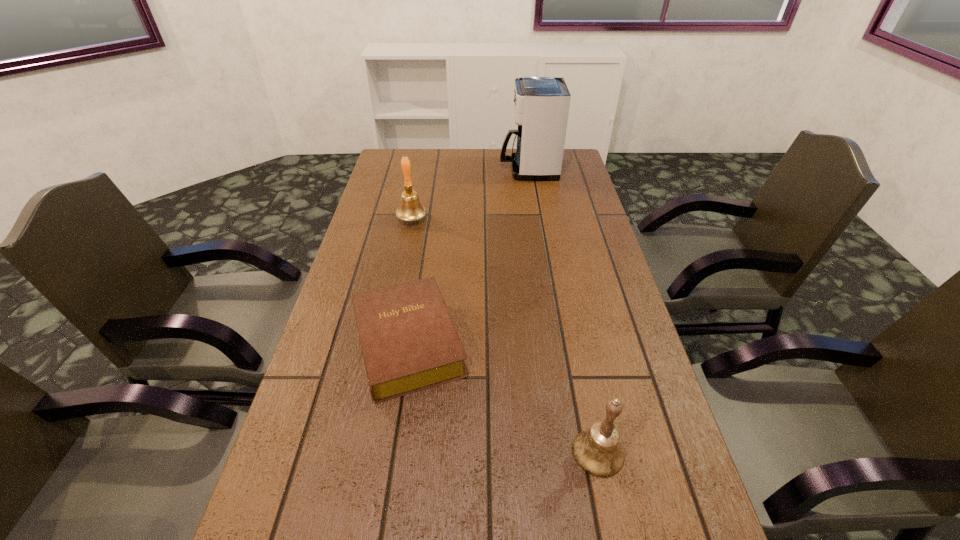
Identify the location of blank space located on the front panel of the coffee maker. Image resolution: width=960 pixels, height=540 pixels. (423, 170).

At what (x,y) coordinates should I click in order to perform the action: click on free spot located on the right of the third shortest object. Please return your answer as a coordinate pair (x, y). The image size is (960, 540). Looking at the image, I should click on click(x=445, y=219).

At what (x,y) coordinates should I click in order to perform the action: click on vacant space located on the left of the shorter bell. Please return your answer as a coordinate pair (x, y). The image size is (960, 540). Looking at the image, I should click on (421, 452).

At what (x,y) coordinates should I click in order to perform the action: click on free space located 0.130m on the back of the Bible. Please return your answer as a coordinate pair (x, y). Looking at the image, I should click on (420, 264).

Identify the location of object that is positioned at the far edge. The width and height of the screenshot is (960, 540). (541, 104).

This screenshot has height=540, width=960. Find the location of `bell located in the left edge section of the desktop`. bell located in the left edge section of the desktop is located at coordinates (410, 209).

Identify the location of Bible that is at the left edge. This screenshot has width=960, height=540. (409, 342).

The width and height of the screenshot is (960, 540). Identify the location of coffee maker that is at the right edge. (541, 104).

Find the location of `bell located at the right edge`. bell located at the right edge is located at coordinates (597, 450).

What are the coordinates of `object that is at the far right corner` in the screenshot? It's located at (541, 104).